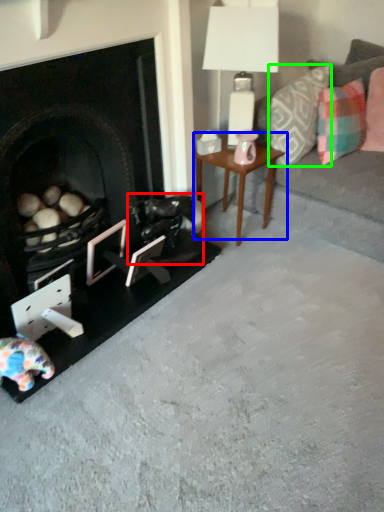
Question: Based on their relative distances, which object is farther from swivel chair (highlighted by a red box)? Choose from table (highlighted by a blue box) and pillow (highlighted by a green box).

Choices:
 (A) table
 (B) pillow

Answer: (B)